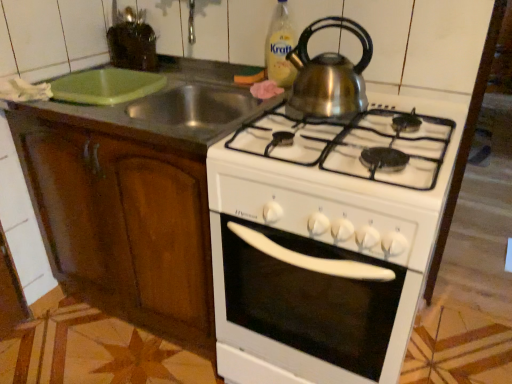
Question: From the image's perspective, is wooden cabinet at left on top of shiny metallic kettle at upper center?

Choices:
 (A) no
 (B) yes

Answer: (A)

Question: Can you confirm if wooden cabinet at left is positioned to the left of shiny metallic kettle at upper center?

Choices:
 (A) no
 (B) yes

Answer: (B)

Question: From a real-world perspective, is wooden cabinet at left over shiny metallic kettle at upper center?

Choices:
 (A) no
 (B) yes

Answer: (A)

Question: Are wooden cabinet at left and shiny metallic kettle at upper center making contact?

Choices:
 (A) no
 (B) yes

Answer: (A)

Question: Can you confirm if wooden cabinet at left is thinner than shiny metallic kettle at upper center?

Choices:
 (A) yes
 (B) no

Answer: (B)

Question: From the image's perspective, is wooden cabinet at left located beneath shiny metallic kettle at upper center?

Choices:
 (A) no
 (B) yes

Answer: (B)

Question: Does translucent plastic bottle at upper center have a greater height compared to shiny metallic kettle at upper center?

Choices:
 (A) no
 (B) yes

Answer: (B)

Question: From the image's perspective, is translucent plastic bottle at upper center on top of shiny metallic kettle at upper center?

Choices:
 (A) yes
 (B) no

Answer: (A)

Question: Is translucent plastic bottle at upper center aimed at shiny metallic kettle at upper center?

Choices:
 (A) yes
 (B) no

Answer: (B)

Question: Does translucent plastic bottle at upper center touch shiny metallic kettle at upper center?

Choices:
 (A) no
 (B) yes

Answer: (A)

Question: From a real-world perspective, is translucent plastic bottle at upper center on top of shiny metallic kettle at upper center?

Choices:
 (A) no
 (B) yes

Answer: (B)

Question: Is translucent plastic bottle at upper center to the right of shiny metallic kettle at upper center from the viewer's perspective?

Choices:
 (A) no
 (B) yes

Answer: (A)

Question: From the image's perspective, is shiny metallic kettle at upper center located above wooden cabinet at left?

Choices:
 (A) yes
 (B) no

Answer: (A)